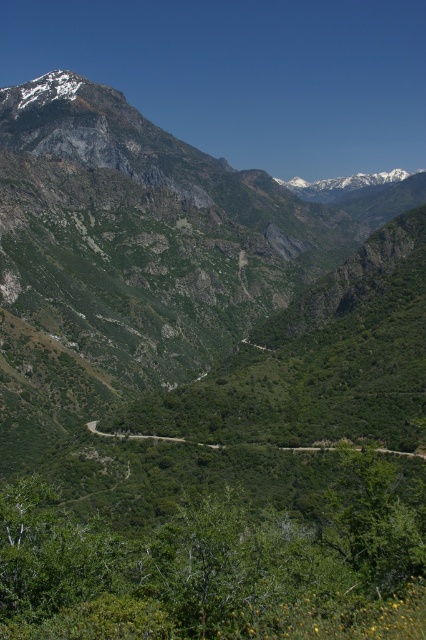
Which is more to the left, green rocky mountain range at upper left or green leafy road at center?

green leafy road at center

Is green rocky mountain range at upper left positioned before green leafy road at center?

Yes, it is in front of green leafy road at center.

Does point (213, 198) come behind point (423, 452)?

That is True.

This screenshot has height=640, width=426. What are the coordinates of `green rocky mountain range at upper left` in the screenshot? It's located at (192, 310).